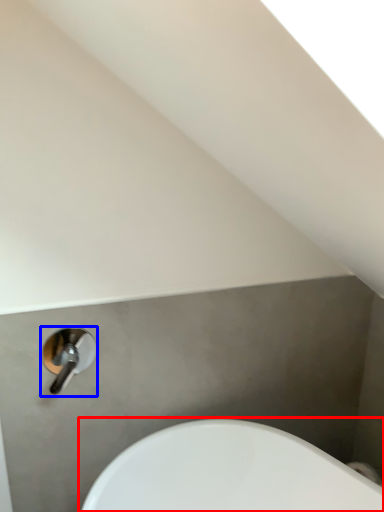
Question: Among these objects, which one is farthest to the camera, sink (highlighted by a red box) or tap (highlighted by a blue box)?

Choices:
 (A) sink
 (B) tap

Answer: (B)